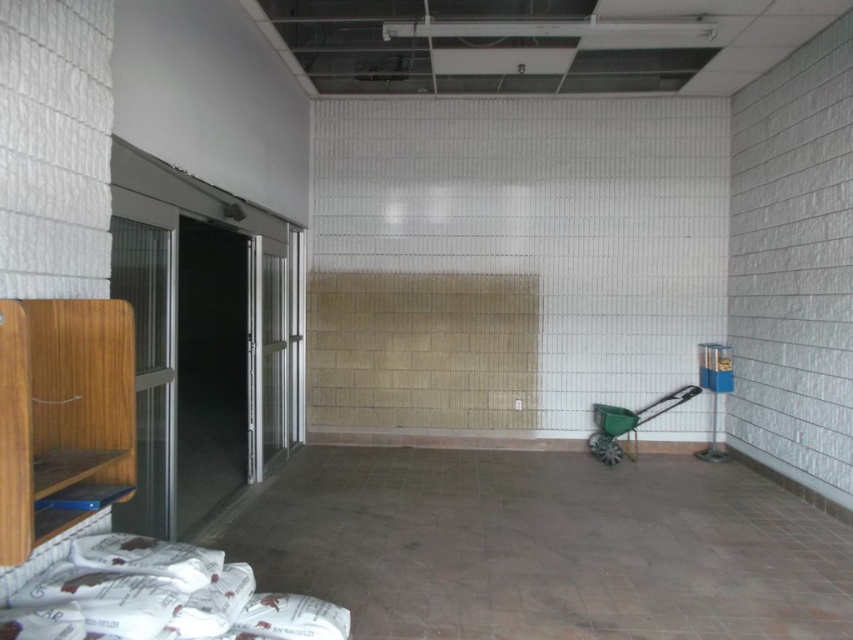
Question: Which point is farther to the camera?

Choices:
 (A) green plastic wheelbarrow at lower right
 (B) brown concrete floor at lower center

Answer: (A)

Question: Does brown concrete floor at lower center lie behind green plastic wheelbarrow at lower right?

Choices:
 (A) no
 (B) yes

Answer: (A)

Question: Is brown concrete floor at lower center to the left of green plastic wheelbarrow at lower right from the viewer's perspective?

Choices:
 (A) yes
 (B) no

Answer: (A)

Question: Observing the image, what is the correct spatial positioning of brown concrete floor at lower center in reference to green plastic wheelbarrow at lower right?

Choices:
 (A) right
 (B) left

Answer: (B)

Question: Which point is farther to the camera?

Choices:
 (A) (688, 394)
 (B) (604, 634)

Answer: (A)

Question: Among these objects, which one is farthest from the camera?

Choices:
 (A) green plastic wheelbarrow at lower right
 (B) brown concrete floor at lower center

Answer: (A)